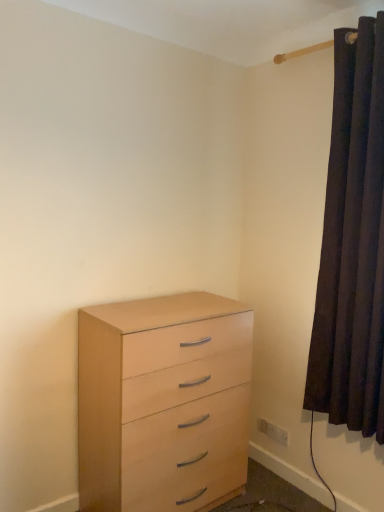
Question: From a real-world perspective, is dark velvet curtain at right positioned over light wood chest of drawers at lower left based on gravity?

Choices:
 (A) no
 (B) yes

Answer: (B)

Question: Does dark velvet curtain at right turn towards light wood chest of drawers at lower left?

Choices:
 (A) no
 (B) yes

Answer: (A)

Question: Can light wood chest of drawers at lower left be found inside dark velvet curtain at right?

Choices:
 (A) no
 (B) yes

Answer: (A)

Question: Can you confirm if dark velvet curtain at right is thinner than light wood chest of drawers at lower left?

Choices:
 (A) yes
 (B) no

Answer: (A)

Question: Is dark velvet curtain at right facing away from light wood chest of drawers at lower left?

Choices:
 (A) no
 (B) yes

Answer: (A)

Question: Considering their positions, is dark velvet curtain at right located in front of or behind light wood chest of drawers at lower left?

Choices:
 (A) front
 (B) behind

Answer: (A)

Question: Is dark velvet curtain at right taller or shorter than light wood chest of drawers at lower left?

Choices:
 (A) short
 (B) tall

Answer: (B)

Question: From a real-world perspective, is dark velvet curtain at right physically located above or below light wood chest of drawers at lower left?

Choices:
 (A) below
 (B) above

Answer: (B)

Question: From the image's perspective, is dark velvet curtain at right positioned above or below light wood chest of drawers at lower left?

Choices:
 (A) below
 (B) above

Answer: (B)

Question: Is light wood chest of drawers at lower left inside the boundaries of white plastic electric outlet at lower right, or outside?

Choices:
 (A) inside
 (B) outside

Answer: (B)

Question: Based on their sizes in the image, would you say light wood chest of drawers at lower left is bigger or smaller than white plastic electric outlet at lower right?

Choices:
 (A) small
 (B) big

Answer: (B)

Question: From a real-world perspective, relative to white plastic electric outlet at lower right, is light wood chest of drawers at lower left vertically above or below?

Choices:
 (A) below
 (B) above

Answer: (B)

Question: Looking at their shapes, would you say light wood chest of drawers at lower left is wider or thinner than white plastic electric outlet at lower right?

Choices:
 (A) thin
 (B) wide

Answer: (B)

Question: Looking at their shapes, would you say light wood chest of drawers at lower left is wider or thinner than dark velvet curtain at right?

Choices:
 (A) wide
 (B) thin

Answer: (A)

Question: From a real-world perspective, is light wood chest of drawers at lower left physically located above or below dark velvet curtain at right?

Choices:
 (A) above
 (B) below

Answer: (B)